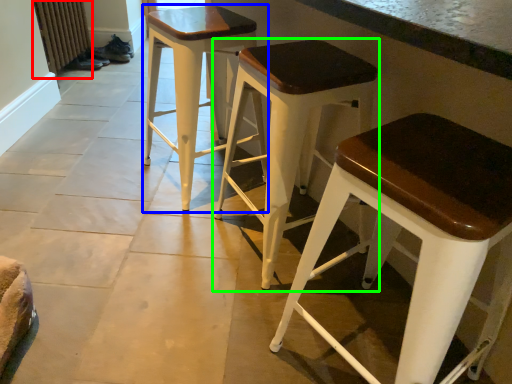
Question: Estimate the real-world distances between objects in this image. Which object is closer to radiator (highlighted by a red box), stool (highlighted by a blue box) or stool (highlighted by a green box)?

Choices:
 (A) stool
 (B) stool

Answer: (A)